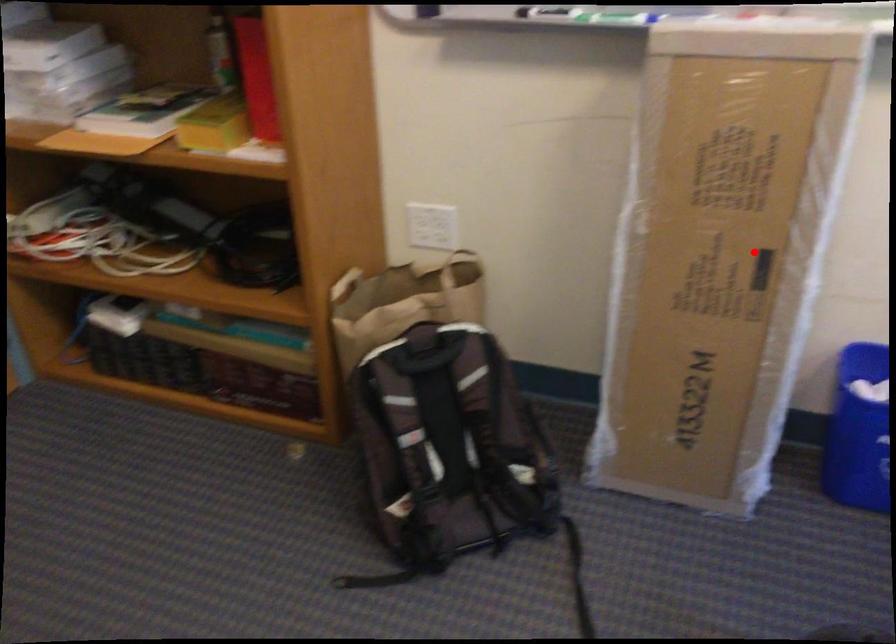
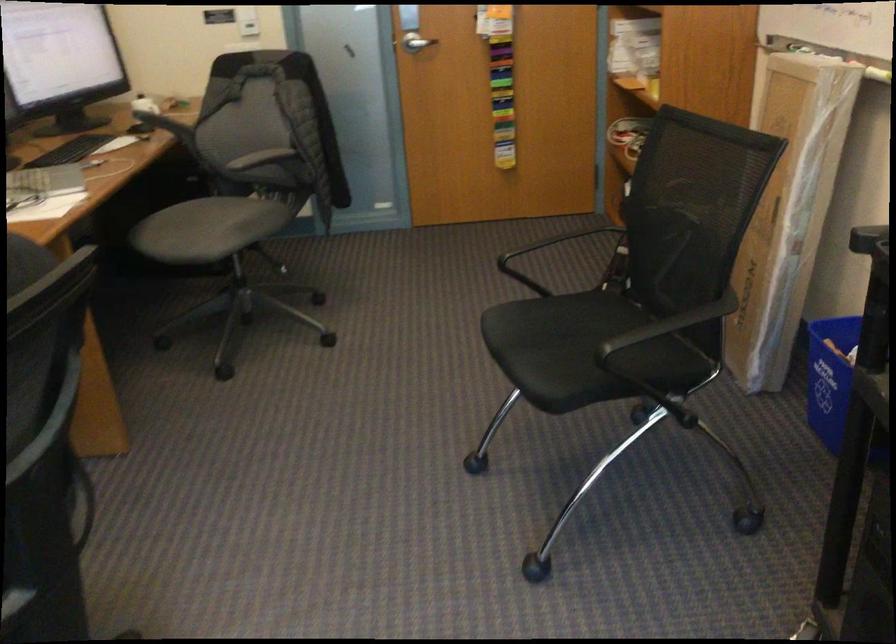
Question: I am providing you with two images of the same scene from different viewpoints. In image1, a red point is highlighted. Considering the same 3D point in image2, which of the following is correct?

Choices:
 (A) It is closer
 (B) It is farther

Answer: (B)